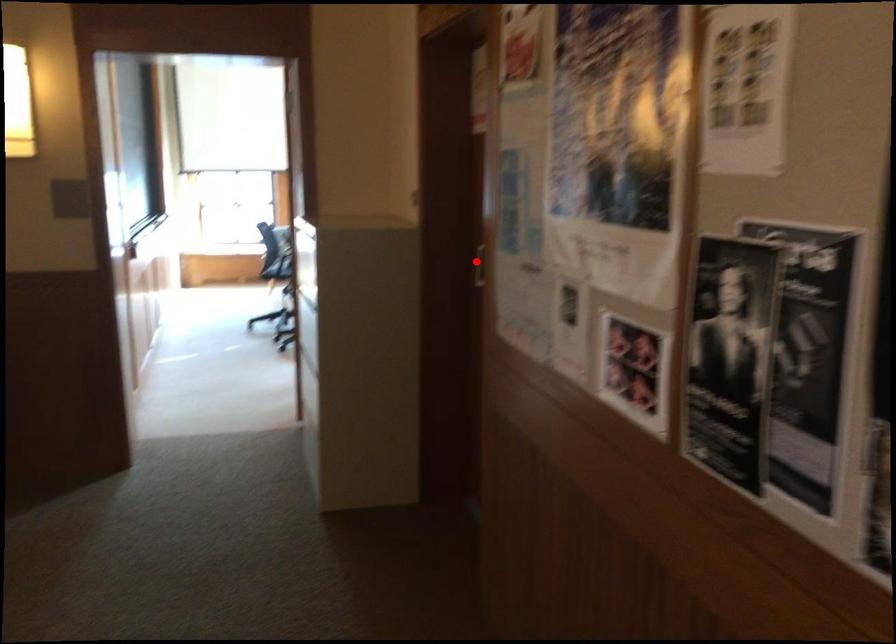
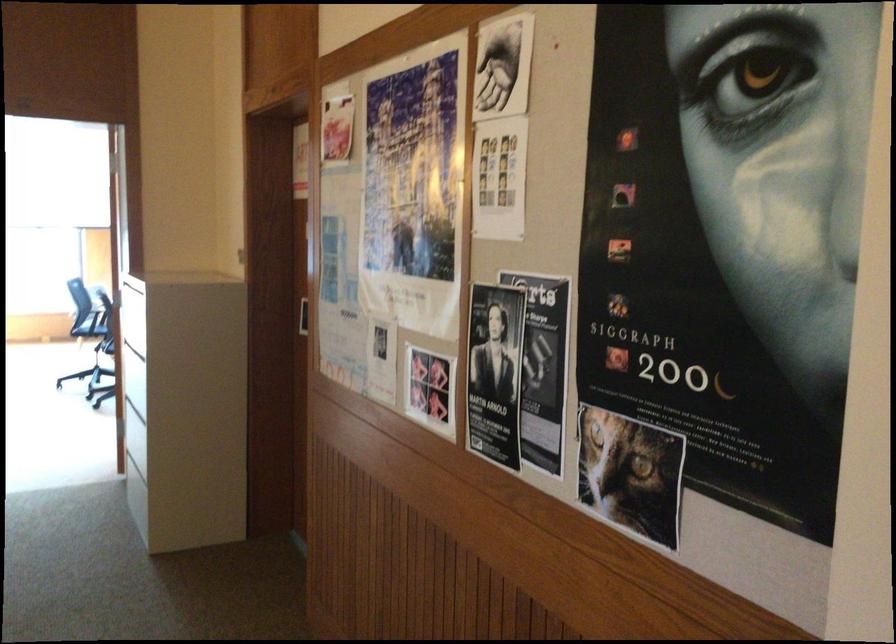
Question: I am providing you with two images of the same scene from different viewpoints. A red point is shown in image1. For the corresponding object point in image2, is it positioned nearer or farther from the camera?

Choices:
 (A) Nearer
 (B) Farther

Answer: (B)